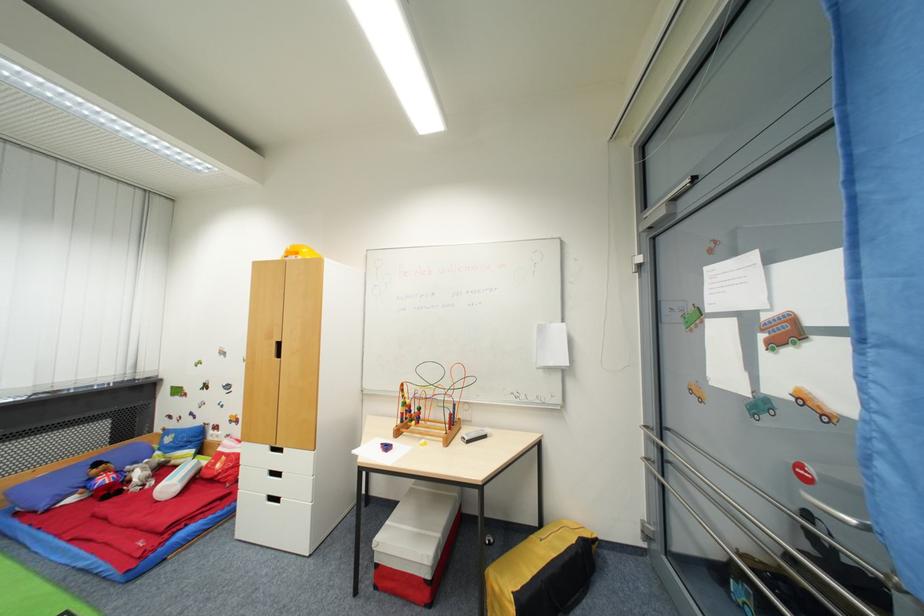
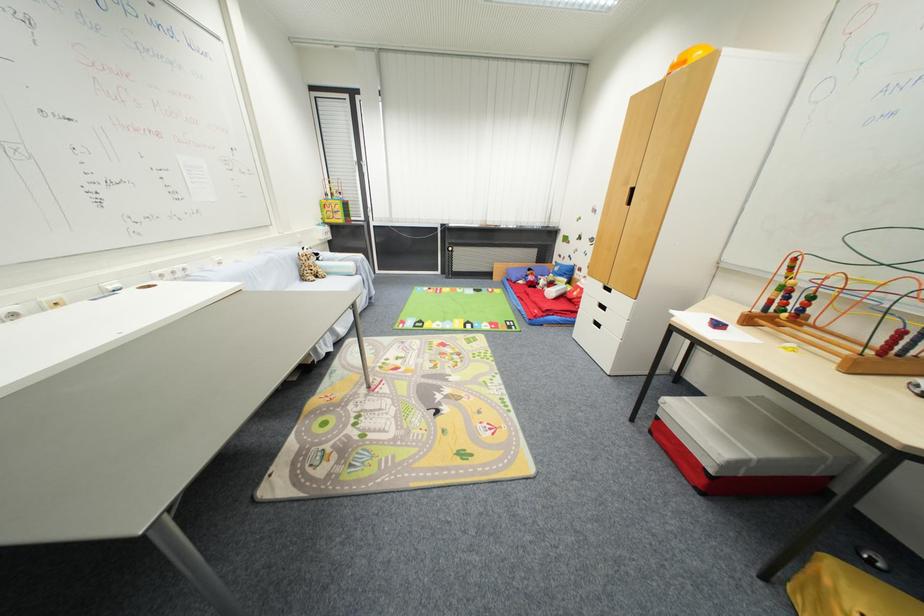
Find the pixel in the second image that matches the point at 417,422 in the first image.

(789, 313)